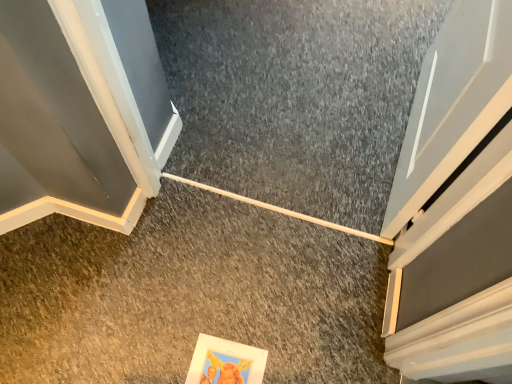
Question: Which direction should I rotate to look at gray carpet at center, the 1th concrete positioned from the front, — up or down?

Choices:
 (A) down
 (B) up

Answer: (A)

Question: Is gray carpet at center, the 1th concrete positioned from the front, outside smooth gray carpet at center, arranged as the 1th concrete when viewed from the back?

Choices:
 (A) yes
 (B) no

Answer: (A)

Question: Can you confirm if gray carpet at center, the 1th concrete positioned from the front, is bigger than smooth gray carpet at center, arranged as the 2th concrete when viewed from the front?

Choices:
 (A) yes
 (B) no

Answer: (B)

Question: Could you tell me if gray carpet at center, which is the second concrete in back-to-front order, is facing smooth gray carpet at center, arranged as the 2th concrete when viewed from the front?

Choices:
 (A) no
 (B) yes

Answer: (B)

Question: Can you confirm if gray carpet at center, the 1th concrete positioned from the front, is positioned to the right of smooth gray carpet at center, arranged as the 2th concrete when viewed from the front?

Choices:
 (A) yes
 (B) no

Answer: (B)

Question: Is gray carpet at center, the 1th concrete positioned from the front, wider than smooth gray carpet at center, arranged as the 1th concrete when viewed from the back?

Choices:
 (A) no
 (B) yes

Answer: (A)

Question: Is the surface of gray carpet at center, the 1th concrete positioned from the front, in direct contact with smooth gray carpet at center, arranged as the 1th concrete when viewed from the back?

Choices:
 (A) yes
 (B) no

Answer: (B)

Question: Is smooth gray carpet at center, arranged as the 2th concrete when viewed from the front, behind gray carpet at center, which is the second concrete in back-to-front order?

Choices:
 (A) yes
 (B) no

Answer: (A)

Question: From a real-world perspective, is smooth gray carpet at center, arranged as the 2th concrete when viewed from the front, below gray carpet at center, which is the second concrete in back-to-front order?

Choices:
 (A) yes
 (B) no

Answer: (A)

Question: Is the depth of smooth gray carpet at center, arranged as the 1th concrete when viewed from the back, less than that of gray carpet at center, which is the second concrete in back-to-front order?

Choices:
 (A) no
 (B) yes

Answer: (A)

Question: Can you confirm if smooth gray carpet at center, arranged as the 1th concrete when viewed from the back, is positioned to the left of gray carpet at center, the 1th concrete positioned from the front?

Choices:
 (A) yes
 (B) no

Answer: (B)

Question: Is smooth gray carpet at center, arranged as the 1th concrete when viewed from the back, oriented towards gray carpet at center, which is the second concrete in back-to-front order?

Choices:
 (A) no
 (B) yes

Answer: (A)

Question: Considering the relative positions of smooth gray carpet at center, arranged as the 2th concrete when viewed from the front, and gray carpet at center, the 1th concrete positioned from the front, in the image provided, is smooth gray carpet at center, arranged as the 2th concrete when viewed from the front, to the right of gray carpet at center, the 1th concrete positioned from the front, from the viewer's perspective?

Choices:
 (A) no
 (B) yes

Answer: (B)

Question: In the image, is smooth gray carpet at center, arranged as the 2th concrete when viewed from the front, positioned in front of or behind gray carpet at center, which is the second concrete in back-to-front order?

Choices:
 (A) front
 (B) behind

Answer: (B)